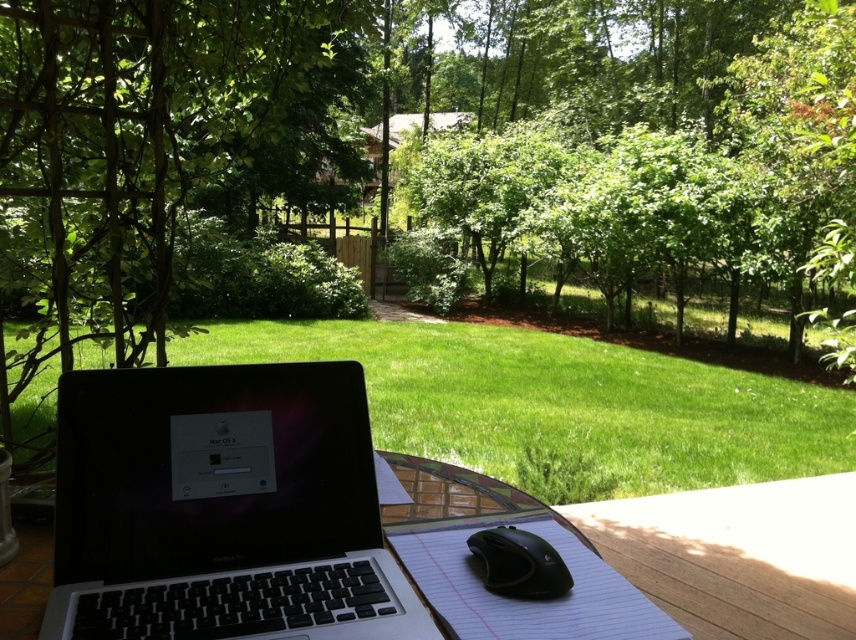
You are a photographer setting up a tripod in this scene. You want to capture a clear shot of the sleek black laptop at lower left without any obstructions. Considering the green leafy tree at upper center, where should you position your tripod to ensure the laptop is visible and the tree isn t blocking it?

The sleek black laptop at lower left is behind the green leafy tree at upper center. To capture a clear shot of the laptop without obstruction, position the tripod in front of the laptop, ensuring the tree is not between the camera and the laptop.

From the picture: You are planning to take a photo of the metallic silver picnic table at center. Since the green leafy tree at upper center is in the background, will the tree block the view of the picnic table?

The green leafy tree at upper center has a larger width than the metallic silver picnic table at center, so it may block part of the picnic table depending on their positions.

Looking at this image, you are planning to set up a small garden party and need to place a 3.5 meter long banner between the green leafy tree at upper center and the metallic silver picnic table at center. Will the banner fit perfectly between them without needing to be folded or cut?

The distance between the green leafy tree at upper center and the metallic silver picnic table at center is 7.35 meters. Since the banner is only 3.5 meters long, it will fit perfectly between them with extra space remaining.